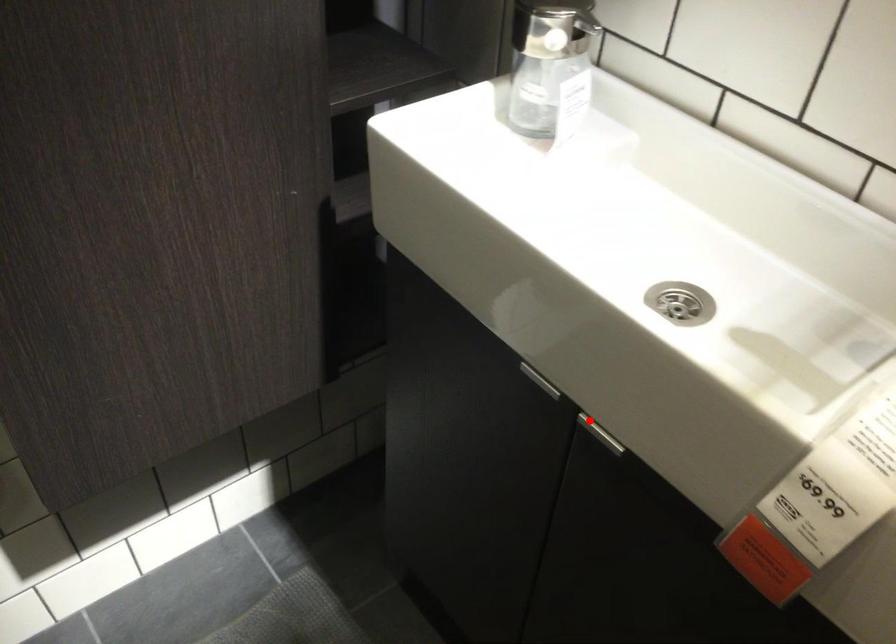
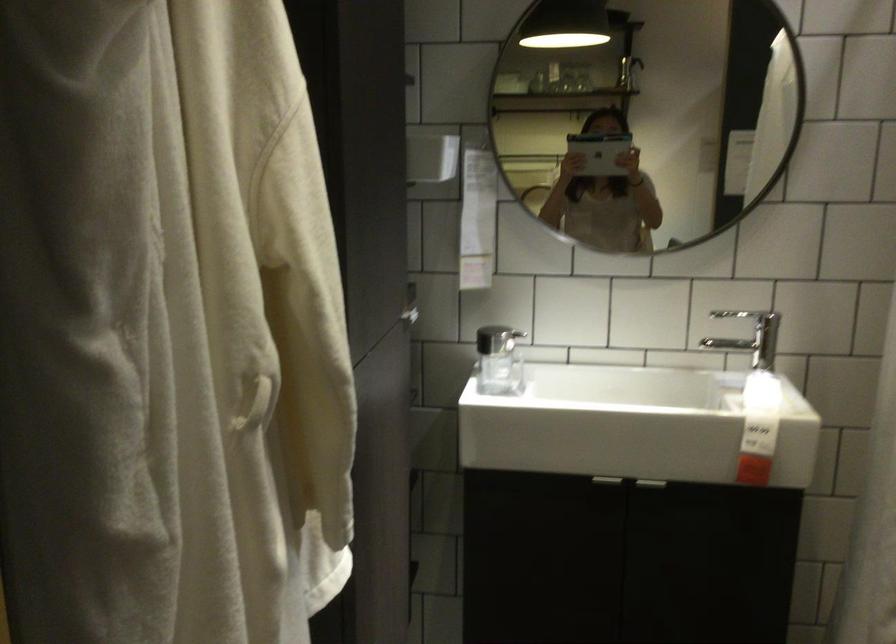
Question: I am providing you with two images of the same scene from different viewpoints. Given a red point in image1, look at the same physical point in image2. Is it:

Choices:
 (A) Closer to the viewpoint
 (B) Farther from the viewpoint

Answer: (B)